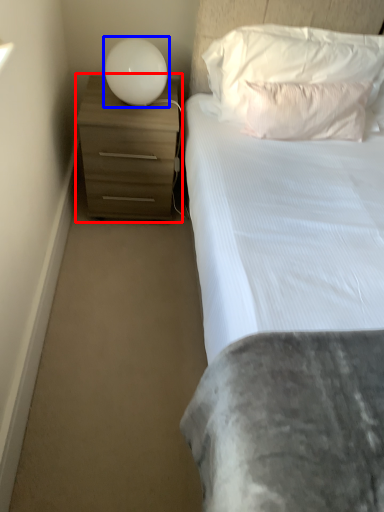
Question: Which point is further to the camera, chest of drawers (highlighted by a red box) or lamp (highlighted by a blue box)?

Choices:
 (A) chest of drawers
 (B) lamp

Answer: (A)